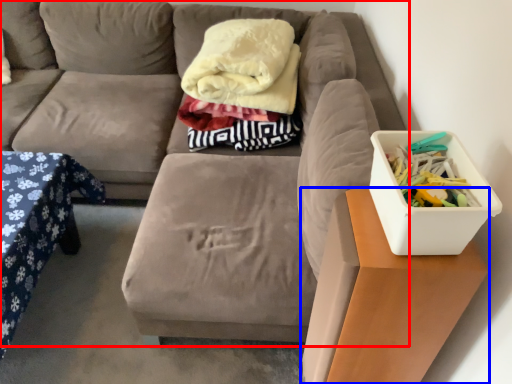
Question: Which object is closer to the camera taking this photo, studio couch (highlighted by a red box) or table (highlighted by a blue box)?

Choices:
 (A) studio couch
 (B) table

Answer: (B)